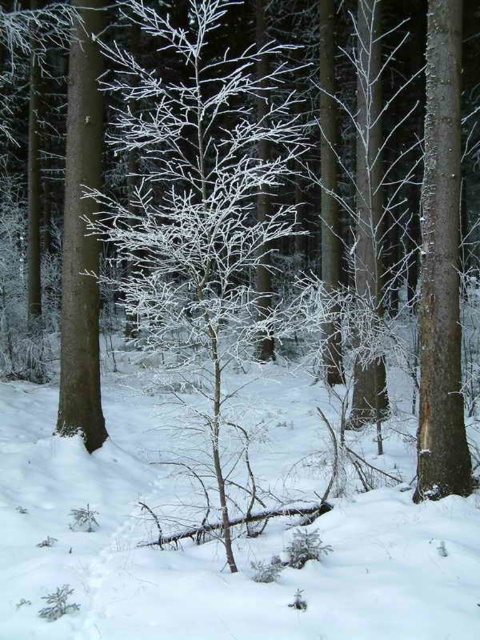
Question: Which object appears closest to the camera in this image?

Choices:
 (A) white frosty snow at center
 (B) frosted white tree at center

Answer: (B)

Question: Is white frosty snow at center to the left of frosted white tree at center from the viewer's perspective?

Choices:
 (A) yes
 (B) no

Answer: (B)

Question: From the image, what is the correct spatial relationship of white frosty snow at center in relation to frosted white tree at center?

Choices:
 (A) below
 (B) above

Answer: (A)

Question: Does white frosty snow at center have a greater width compared to frosted white tree at center?

Choices:
 (A) no
 (B) yes

Answer: (A)